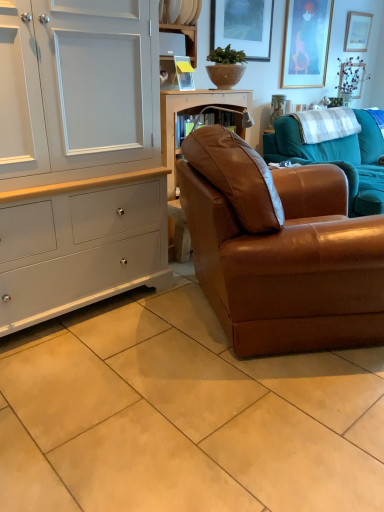
The height and width of the screenshot is (512, 384). I want to click on gold-framed picture at upper right, arranged as the 2th picture frame when viewed from the right, so click(x=306, y=42).

Find the location of a particular element. This screenshot has height=512, width=384. green matte vase at upper right is located at coordinates (351, 78).

This screenshot has height=512, width=384. Describe the element at coordinates (243, 26) in the screenshot. I see `matte glass picture frame at upper center, the 3th picture frame positioned from the right` at that location.

This screenshot has height=512, width=384. What do you see at coordinates (183, 415) in the screenshot?
I see `beige ceramic tile at lower center` at bounding box center [183, 415].

Locate an element on the screen. The image size is (384, 512). gold-framed picture at upper right, arranged as the 2th picture frame when viewed from the right is located at coordinates (306, 42).

Considering the positions of objects white painted wood cabinet at left and white wood shelf at upper center, the 1th shelf viewed from the top, in the image provided, who is more to the right, white painted wood cabinet at left or white wood shelf at upper center, the 1th shelf viewed from the top,?

Positioned to the right is white wood shelf at upper center, the 1th shelf viewed from the top.

From the image's perspective, between white painted wood cabinet at left and white wood shelf at upper center, which appears as the second shelf when ordered from the bottom, who is located below?

From the image's view, white painted wood cabinet at left is below.

Is white painted wood cabinet at left next to white wood shelf at upper center, the 1th shelf viewed from the top, and touching it?

No, white painted wood cabinet at left is not touching white wood shelf at upper center, the 1th shelf viewed from the top.

Which is closer to the camera, (9, 252) or (184, 25)?

Positioned in front is point (9, 252).

Is gold-framed picture at upper right, which is the 2th picture frame from front to back, wider than beige ceramic tile at lower center?

In fact, gold-framed picture at upper right, which is the 2th picture frame from front to back, might be narrower than beige ceramic tile at lower center.

Is gold-framed picture at upper right, which is the 2th picture frame from front to back, aimed at beige ceramic tile at lower center?

No, gold-framed picture at upper right, which is the 2th picture frame from front to back, is not facing towards beige ceramic tile at lower center.

Can you tell me how much gold-framed picture at upper right, which is the 2th picture frame from front to back, and beige ceramic tile at lower center differ in facing direction?

89.2 degrees.

Looking at this image, from a real-world perspective, which object rests below the other?

In real-world perspective, beige ceramic tile at lower center is lower.

Is white checkered blanket at upper right oriented away from white wood shelf at upper center, which appears as the second shelf when ordered from the bottom?

No, white checkered blanket at upper right's orientation is not away from white wood shelf at upper center, which appears as the second shelf when ordered from the bottom.

Is white checkered blanket at upper right to the left or to the right of white wood shelf at upper center, the 1th shelf viewed from the top, in the image?

white checkered blanket at upper right is to the right of white wood shelf at upper center, the 1th shelf viewed from the top.

From the image's perspective, which object appears higher, white checkered blanket at upper right or white wood shelf at upper center, which appears as the second shelf when ordered from the bottom?

white wood shelf at upper center, which appears as the second shelf when ordered from the bottom.

Does white checkered blanket at upper right lie in front of white wood shelf at upper center, which appears as the second shelf when ordered from the bottom?

No, white checkered blanket at upper right is further to the viewer.

Is green matte vase at upper right wider or thinner than white plastic shelf at upper center, the 1th shelf ordered from the bottom?

In the image, green matte vase at upper right appears to be more narrow than white plastic shelf at upper center, the 1th shelf ordered from the bottom.

From a real-world perspective, is green matte vase at upper right physically below white plastic shelf at upper center, the 1th shelf ordered from the bottom?

Correct, in the physical world, green matte vase at upper right is lower than white plastic shelf at upper center, the 1th shelf ordered from the bottom.

Would you consider green matte vase at upper right to be distant from white plastic shelf at upper center, marked as the 2th shelf in a top-to-bottom arrangement?

Yes, green matte vase at upper right and white plastic shelf at upper center, marked as the 2th shelf in a top-to-bottom arrangement, are located far from each other.

Which object is positioned more to the right, green matte vase at upper right or white plastic shelf at upper center, the 1th shelf ordered from the bottom?

Positioned to the right is green matte vase at upper right.

In the scene shown: From a real-world perspective, is matte glass picture frame at upper center, the 3th picture frame positioned from the right, on top of white checkered blanket at upper right?

Correct, in the physical world, matte glass picture frame at upper center, the 3th picture frame positioned from the right, is higher than white checkered blanket at upper right.

Choose the correct answer: Is matte glass picture frame at upper center, the 1th picture frame viewed from the front, inside white checkered blanket at upper right or outside it?

matte glass picture frame at upper center, the 1th picture frame viewed from the front, is spatially situated outside white checkered blanket at upper right.

From the image's perspective, does matte glass picture frame at upper center, the 3th picture frame positioned from the right, appear higher than white checkered blanket at upper right?

Yes, from the image's perspective, matte glass picture frame at upper center, the 3th picture frame positioned from the right, is above white checkered blanket at upper right.

Is matte glass picture frame at upper center, the 1th picture frame viewed from the front, oriented towards white checkered blanket at upper right?

No, matte glass picture frame at upper center, the 1th picture frame viewed from the front, is not oriented towards white checkered blanket at upper right.

Which of these two, matte glass picture frame at upper center, the 1th picture frame viewed from the front, or white plastic shelf at upper center, marked as the 2th shelf in a top-to-bottom arrangement, is thinner?

matte glass picture frame at upper center, the 1th picture frame viewed from the front.

From the image's perspective, would you say matte glass picture frame at upper center, the 3th picture frame positioned from the right, is positioned over white plastic shelf at upper center, marked as the 2th shelf in a top-to-bottom arrangement?

Indeed, from the image's perspective, matte glass picture frame at upper center, the 3th picture frame positioned from the right, is shown above white plastic shelf at upper center, marked as the 2th shelf in a top-to-bottom arrangement.

From a real-world perspective, which is physically below, matte glass picture frame at upper center, which appears as the first picture frame when viewed from the left, or white plastic shelf at upper center, the 1th shelf ordered from the bottom?

white plastic shelf at upper center, the 1th shelf ordered from the bottom, is physically lower.

Which of these two, matte glass picture frame at upper center, the 3th picture frame from the back, or white plastic shelf at upper center, marked as the 2th shelf in a top-to-bottom arrangement, is smaller?

With smaller size is white plastic shelf at upper center, marked as the 2th shelf in a top-to-bottom arrangement.

Could you tell me if white checkered blanket at upper right is turned towards wooden picture frame at upper right, the 1th picture frame in the right-to-left sequence?

No, white checkered blanket at upper right is not oriented towards wooden picture frame at upper right, the 1th picture frame in the right-to-left sequence.

Based on the photo, which point is more forward, [336,115] or [348,19]?

Point [336,115]

In the image, is white checkered blanket at upper right on the left side or the right side of wooden picture frame at upper right, which is the third picture frame in front-to-back order?

Clearly, white checkered blanket at upper right is on the left of wooden picture frame at upper right, which is the third picture frame in front-to-back order, in the image.

How many degrees apart are the facing directions of white checkered blanket at upper right and wooden picture frame at upper right, the 3th picture frame positioned from the left?

The facing directions of white checkered blanket at upper right and wooden picture frame at upper right, the 3th picture frame positioned from the left, are 2.05 degrees apart.

Starting from the white painted wood cabinet at left, which shelf is the 1st one to the right? Please provide its 2D coordinates.

[(179, 30)]

Where is `ceramic tile on the left of the gold-framed picture at upper right, arranged as the 2th picture frame when viewed from the right`? ceramic tile on the left of the gold-framed picture at upper right, arranged as the 2th picture frame when viewed from the right is located at coordinates (183, 415).

Looking at the image, which one is located closer to white plastic shelf at upper center, the 1th shelf ordered from the bottom, white checkered blanket at upper right or matte glass picture frame at upper center, the 3th picture frame positioned from the right?

matte glass picture frame at upper center, the 3th picture frame positioned from the right, lies closer to white plastic shelf at upper center, the 1th shelf ordered from the bottom, than the other object.

When comparing their distances from gold-framed picture at upper right, marked as the 2th picture frame in a back-to-front arrangement, does white plastic shelf at upper center, marked as the 2th shelf in a top-to-bottom arrangement, or matte glass picture frame at upper center, which appears as the first picture frame when viewed from the left, seem closer?

matte glass picture frame at upper center, which appears as the first picture frame when viewed from the left, is positioned closer to the anchor gold-framed picture at upper right, marked as the 2th picture frame in a back-to-front arrangement.

From the image, which object appears to be farther from brown leather couch at center, the first studio couch when ordered from back to front, white plastic shelf at upper center, marked as the 2th shelf in a top-to-bottom arrangement, or green matte vase at upper right?

white plastic shelf at upper center, marked as the 2th shelf in a top-to-bottom arrangement, is further to brown leather couch at center, the first studio couch when ordered from back to front.

Looking at the image, which one is located closer to white plastic shelf at upper center, marked as the 2th shelf in a top-to-bottom arrangement, matte glass picture frame at upper center, the 3th picture frame positioned from the right, or white checkered blanket at upper right?

Among the two, matte glass picture frame at upper center, the 3th picture frame positioned from the right, is located nearer to white plastic shelf at upper center, marked as the 2th shelf in a top-to-bottom arrangement.

Estimate the real-world distances between objects in this image. Which object is further from white painted wood cabinet at left, brown leather couch at right, acting as the first studio couch starting from the front, or white plastic shelf at upper center, marked as the 2th shelf in a top-to-bottom arrangement?

white plastic shelf at upper center, marked as the 2th shelf in a top-to-bottom arrangement, lies further to white painted wood cabinet at left than the other object.

Which object lies nearer to the anchor point brown leather couch at right, acting as the first studio couch starting from the front, white checkered blanket at upper right or green matte vase at upper right?

white checkered blanket at upper right lies closer to brown leather couch at right, acting as the first studio couch starting from the front, than the other object.

Which object lies further to the anchor point white plastic shelf at upper center, marked as the 2th shelf in a top-to-bottom arrangement, white checkered blanket at upper right or beige ceramic tile at lower center?

beige ceramic tile at lower center lies further to white plastic shelf at upper center, marked as the 2th shelf in a top-to-bottom arrangement, than the other object.

Looking at the image, which one is located closer to wooden picture frame at upper right, which is the third picture frame in front-to-back order, white wood shelf at upper center, which appears as the second shelf when ordered from the bottom, or beige ceramic tile at lower center?

white wood shelf at upper center, which appears as the second shelf when ordered from the bottom, lies closer to wooden picture frame at upper right, which is the third picture frame in front-to-back order, than the other object.

Where is `cabinetry between beige ceramic tile at lower center and wooden picture frame at upper right, the 3th picture frame positioned from the left, along the z-axis`? This screenshot has width=384, height=512. cabinetry between beige ceramic tile at lower center and wooden picture frame at upper right, the 3th picture frame positioned from the left, along the z-axis is located at coordinates (86, 164).

Locate an element on the screen. This screenshot has height=512, width=384. blanket located between brown leather couch at right, acting as the first studio couch starting from the front, and gold-framed picture at upper right, arranged as the 2th picture frame when viewed from the right, in the depth direction is located at coordinates (326, 124).

This screenshot has height=512, width=384. Find the location of `studio couch between beige ceramic tile at lower center and brown leather couch at center, placed as the 2th studio couch when sorted from front to back, in the front-back direction`. studio couch between beige ceramic tile at lower center and brown leather couch at center, placed as the 2th studio couch when sorted from front to back, in the front-back direction is located at coordinates (280, 250).

Find the location of a particular element. The width and height of the screenshot is (384, 512). studio couch located between brown leather couch at right, the 2th studio couch from the back, and matte glass picture frame at upper center, the 3th picture frame positioned from the right, in the depth direction is located at coordinates (337, 158).